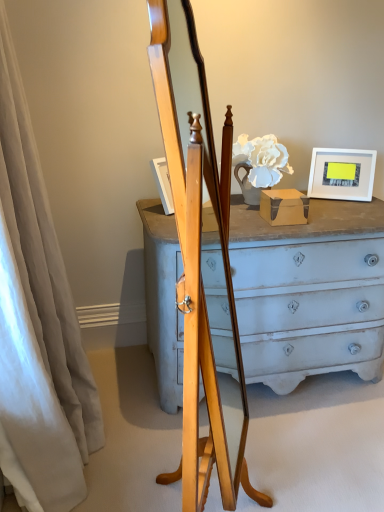
Question: Based on their positions, is white fabric curtain at left located to the left or right of white matte picture frame at upper right?

Choices:
 (A) right
 (B) left

Answer: (B)

Question: Is white fabric curtain at left taller or shorter than white matte picture frame at upper right?

Choices:
 (A) short
 (B) tall

Answer: (B)

Question: Looking at the image, does white fabric curtain at left seem bigger or smaller compared to white matte picture frame at upper right?

Choices:
 (A) small
 (B) big

Answer: (B)

Question: Considering the positions of white matte picture frame at upper right and white fabric curtain at left in the image, is white matte picture frame at upper right taller or shorter than white fabric curtain at left?

Choices:
 (A) tall
 (B) short

Answer: (B)

Question: Is white matte picture frame at upper right situated inside white fabric curtain at left or outside?

Choices:
 (A) inside
 (B) outside

Answer: (B)

Question: In the image, is white matte picture frame at upper right positioned in front of or behind white fabric curtain at left?

Choices:
 (A) behind
 (B) front

Answer: (A)

Question: In terms of size, does white matte picture frame at upper right appear bigger or smaller than white fabric curtain at left?

Choices:
 (A) big
 (B) small

Answer: (B)